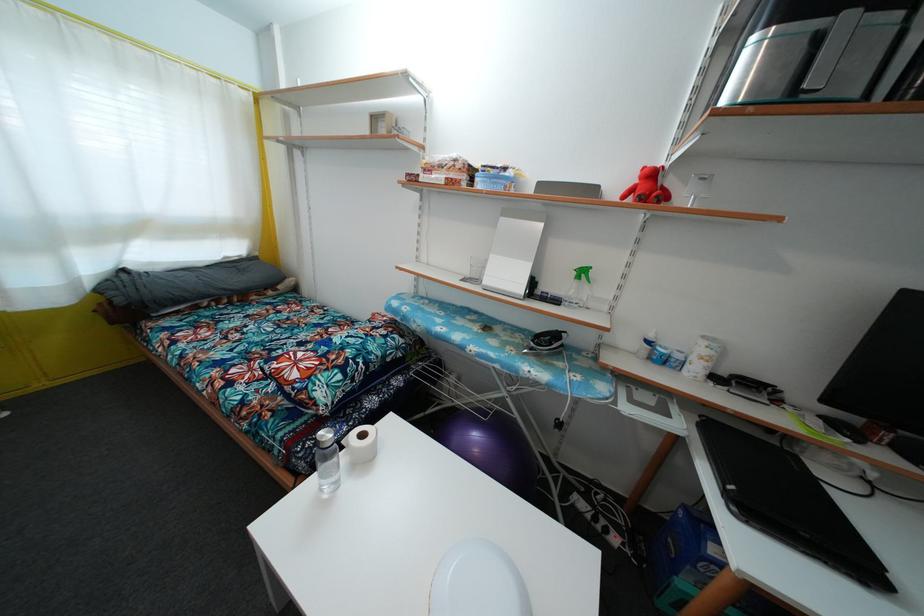
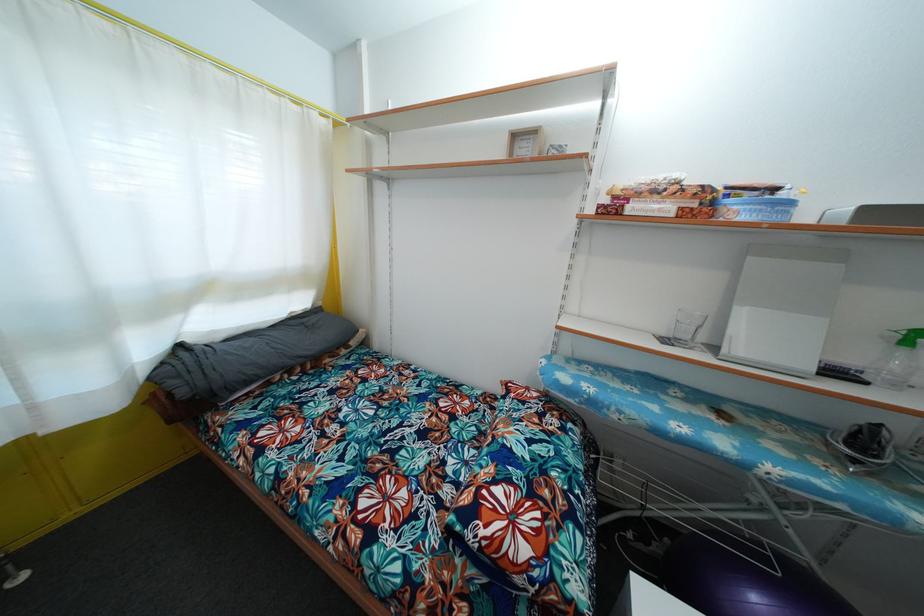
The images are taken continuously from a first-person perspective. In which direction are you moving?

The cameraman walked toward left, forward.